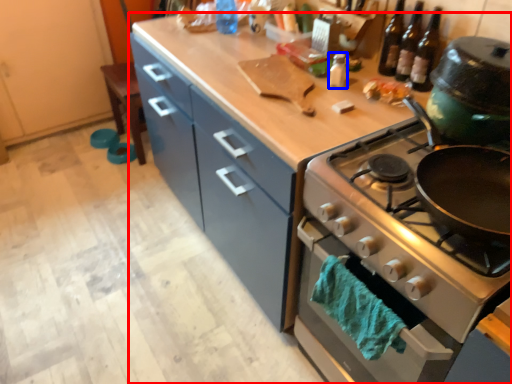
Question: Among these objects, which one is farthest to the camera, countertop (highlighted by a red box) or bottle (highlighted by a blue box)?

Choices:
 (A) countertop
 (B) bottle

Answer: (B)